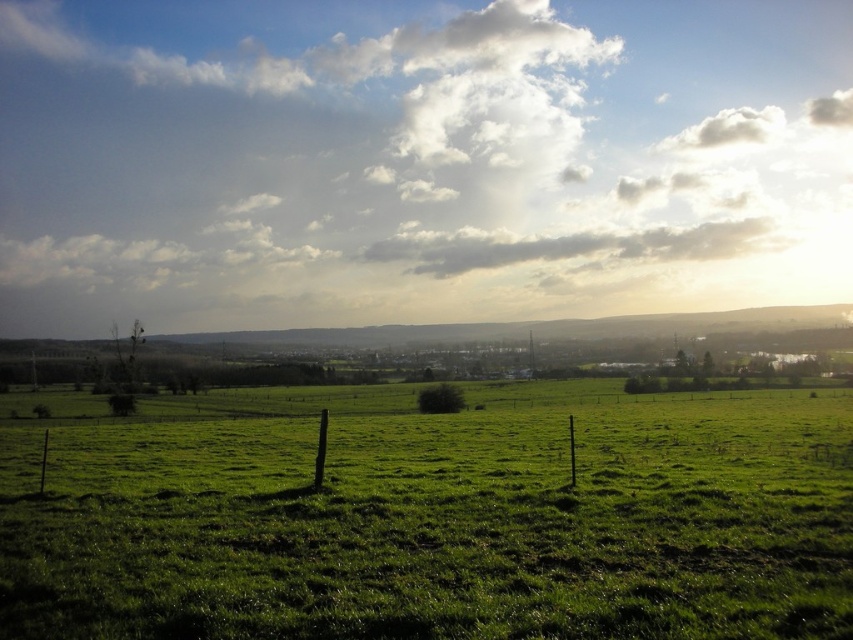
You are a weather balloon operator who needs to launch a balloon from the ground. The balloon will rise straight up and stop at the same height as the white fluffy cloud at upper center. If the cloud is at coordinates 0.252 in the x direction and 0.491 in the y direction, what are the coordinates where the balloon should be launched from to ensure it stops directly under the cloud?

The balloon should be launched from the ground at the x coordinate 0.252, since the cloud is at x 0.252 and y 0.491. The balloon rises straight up, so it only needs to match the x coordinate of the cloud to be directly under it.

Consider the image. You are standing in the field and looking towards the town. There is a point marked at coordinates point [418,161]. What object is located at this point?

The white fluffy cloud at upper center is located at point [418,161].